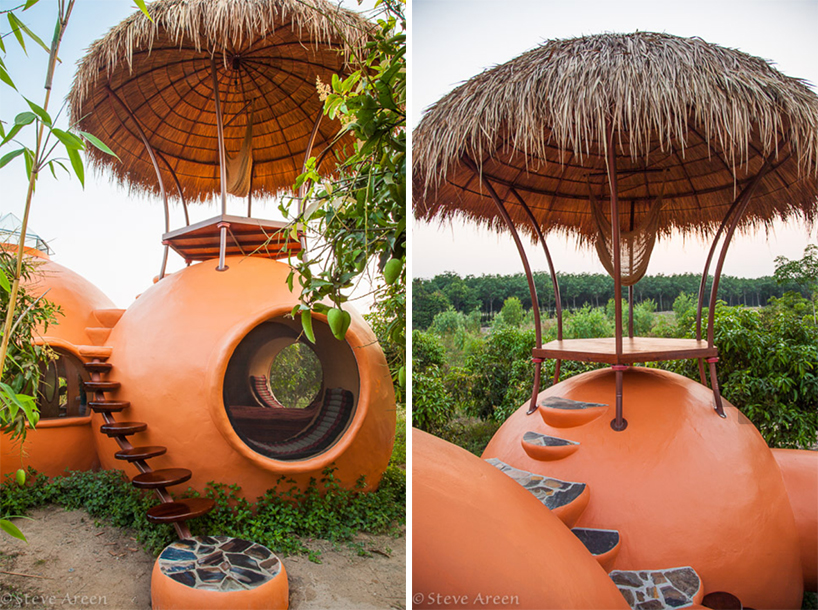
The width and height of the screenshot is (818, 610). Identify the location of stairs with broken tile design. (226, 557), (663, 594), (553, 490), (540, 442), (564, 400).